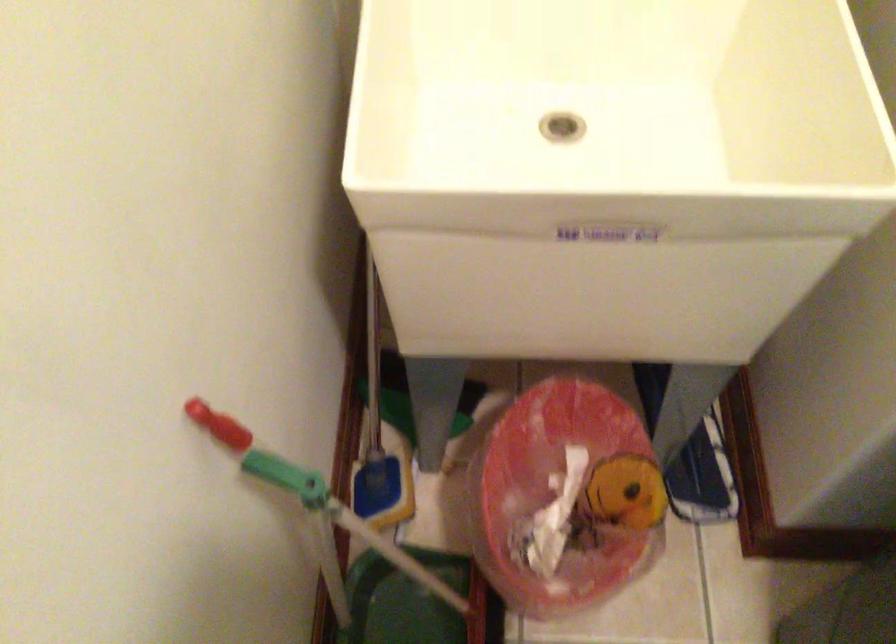
In order to click on blue dustpan handle in this screenshot , I will do `click(373, 483)`.